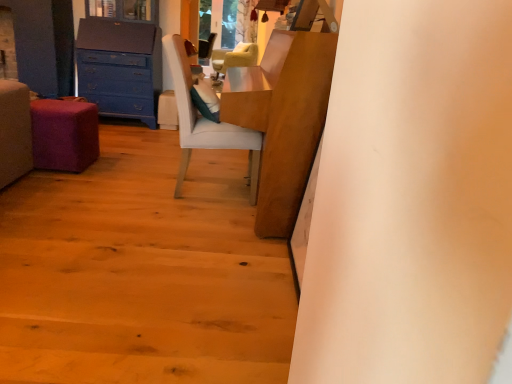
Question: Is purple fabric stool at lower left outside blue painted wood chest of drawers at left?

Choices:
 (A) no
 (B) yes

Answer: (B)

Question: From a real-world perspective, is purple fabric stool at lower left on top of blue painted wood chest of drawers at left?

Choices:
 (A) yes
 (B) no

Answer: (B)

Question: Can you confirm if purple fabric stool at lower left is positioned to the right of blue painted wood chest of drawers at left?

Choices:
 (A) no
 (B) yes

Answer: (A)

Question: Could you tell me if purple fabric stool at lower left is turned towards blue painted wood chest of drawers at left?

Choices:
 (A) yes
 (B) no

Answer: (B)

Question: Considering the relative positions of purple fabric stool at lower left and blue painted wood chest of drawers at left in the image provided, is purple fabric stool at lower left in front of blue painted wood chest of drawers at left?

Choices:
 (A) no
 (B) yes

Answer: (B)

Question: Considering the positions of purple fabric stool at lower left and wooden table at center in the image, is purple fabric stool at lower left wider or thinner than wooden table at center?

Choices:
 (A) wide
 (B) thin

Answer: (B)

Question: Is purple fabric stool at lower left in front of or behind wooden table at center in the image?

Choices:
 (A) behind
 (B) front

Answer: (A)

Question: Considering the relative positions of purple fabric stool at lower left and wooden table at center in the image provided, is purple fabric stool at lower left to the left or to the right of wooden table at center?

Choices:
 (A) right
 (B) left

Answer: (B)

Question: From their relative heights in the image, would you say purple fabric stool at lower left is taller or shorter than wooden table at center?

Choices:
 (A) short
 (B) tall

Answer: (A)

Question: Is velvet beige armchair at center, the 2th chair viewed from the front, to the left or to the right of purple fabric stool at lower left in the image?

Choices:
 (A) left
 (B) right

Answer: (B)

Question: Is point (241, 62) positioned closer to the camera than point (70, 152)?

Choices:
 (A) closer
 (B) farther

Answer: (B)

Question: From a real-world perspective, is velvet beige armchair at center, the 1th chair viewed from the back, physically located above or below purple fabric stool at lower left?

Choices:
 (A) above
 (B) below

Answer: (A)

Question: Is velvet beige armchair at center, the 1th chair viewed from the top, inside or outside of purple fabric stool at lower left?

Choices:
 (A) inside
 (B) outside

Answer: (B)

Question: Visually, is velvet beige armchair at center, the 2th chair viewed from the front, positioned to the left or to the right of wooden floor at lower left?

Choices:
 (A) left
 (B) right

Answer: (B)

Question: Considering the positions of point (230, 59) and point (128, 326), is point (230, 59) closer or farther from the camera than point (128, 326)?

Choices:
 (A) farther
 (B) closer

Answer: (A)